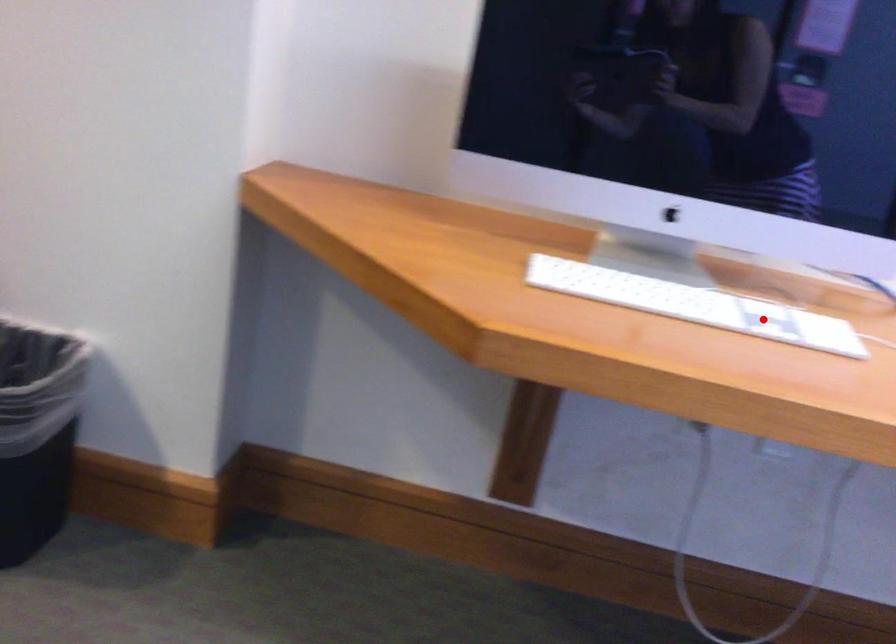
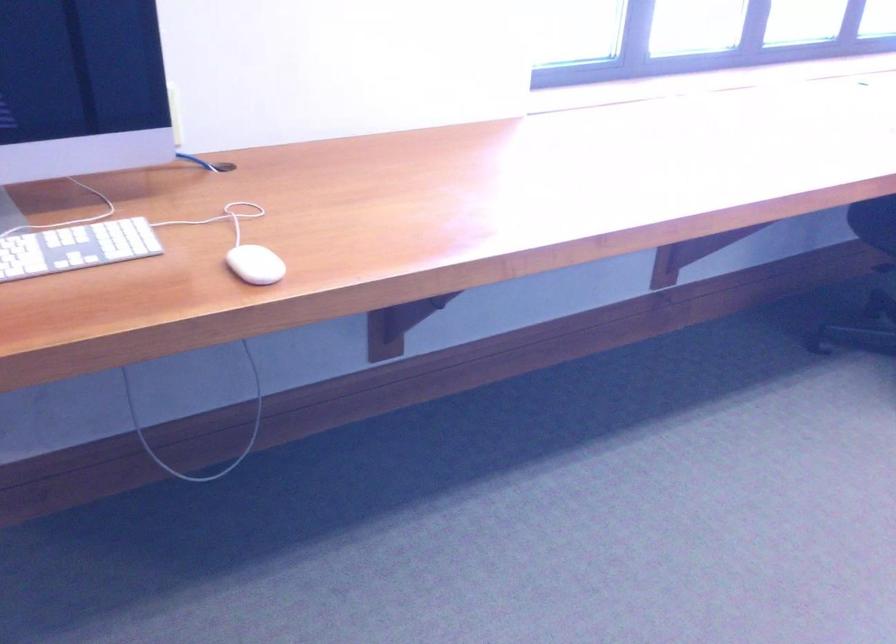
The point at the highlighted location is marked in the first image. Where is the corresponding point in the second image?

(75, 247)